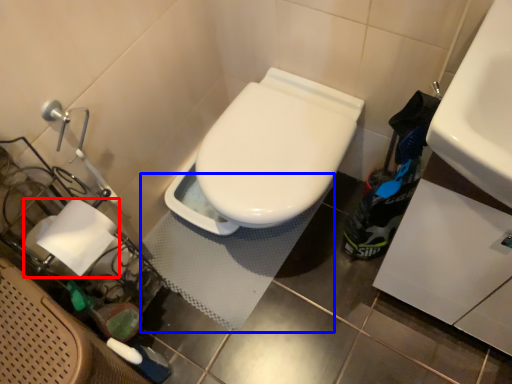
Question: Which object is closer to the camera taking this photo, toilet paper (highlighted by a red box) or bath mat (highlighted by a blue box)?

Choices:
 (A) toilet paper
 (B) bath mat

Answer: (A)